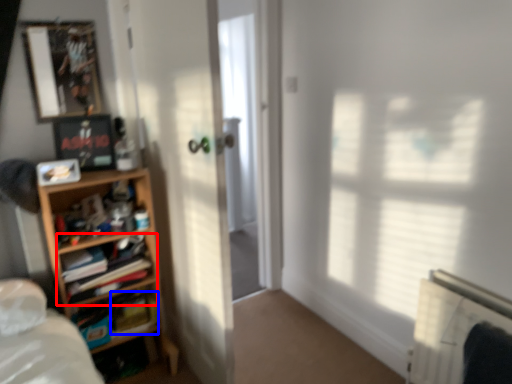
Question: Which object is closer to the camera taking this photo, shelf (highlighted by a red box) or paperback book (highlighted by a blue box)?

Choices:
 (A) shelf
 (B) paperback book

Answer: (A)